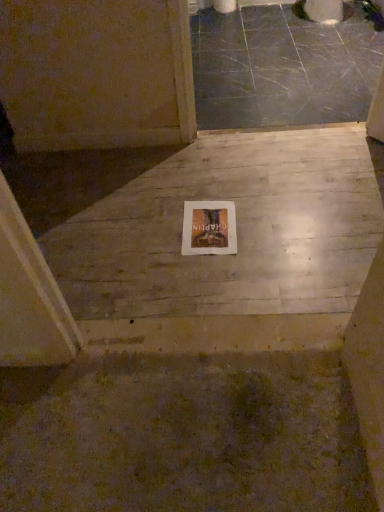
Where is `vacant area located to the right-hand side of wooden book at center`? This screenshot has height=512, width=384. vacant area located to the right-hand side of wooden book at center is located at coordinates (268, 232).